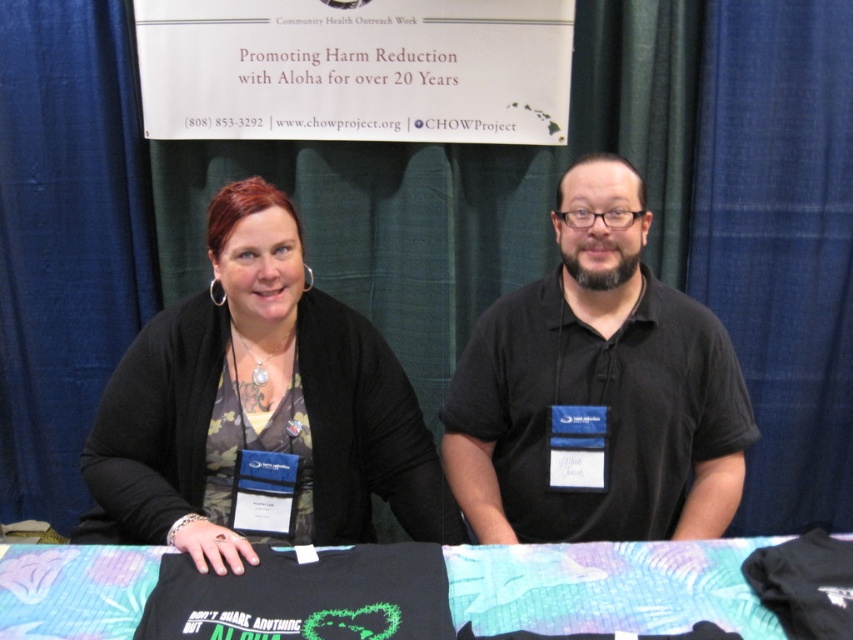
Question: Does camouflage fabric shirt at center have a larger size compared to black fabric at center?

Choices:
 (A) yes
 (B) no

Answer: (A)

Question: Does camouflage fabric shirt at center lie in front of black fabric at center?

Choices:
 (A) no
 (B) yes

Answer: (A)

Question: Can you confirm if camouflage fabric shirt at center is smaller than black matte shirt at center?

Choices:
 (A) no
 (B) yes

Answer: (A)

Question: Based on their relative distances, which object is farther from the black fabric at center?

Choices:
 (A) black matte shirt at center
 (B) camouflage fabric shirt at center

Answer: (B)

Question: Among these points, which one is farthest from the camera?

Choices:
 (A) (444, 552)
 (B) (91, 488)

Answer: (B)

Question: Which object appears closest to the camera in this image?

Choices:
 (A) camouflage fabric shirt at center
 (B) black fabric at center

Answer: (B)